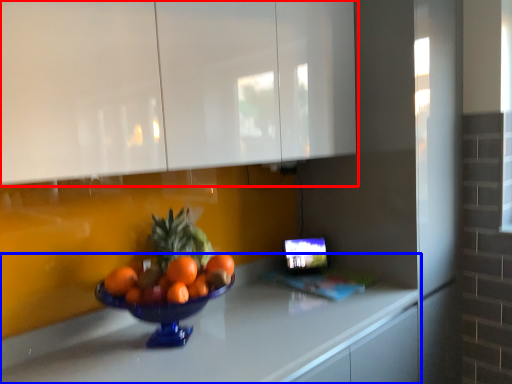
Question: Which point is further to the camera, cabinetry (highlighted by a red box) or countertop (highlighted by a blue box)?

Choices:
 (A) cabinetry
 (B) countertop

Answer: (A)